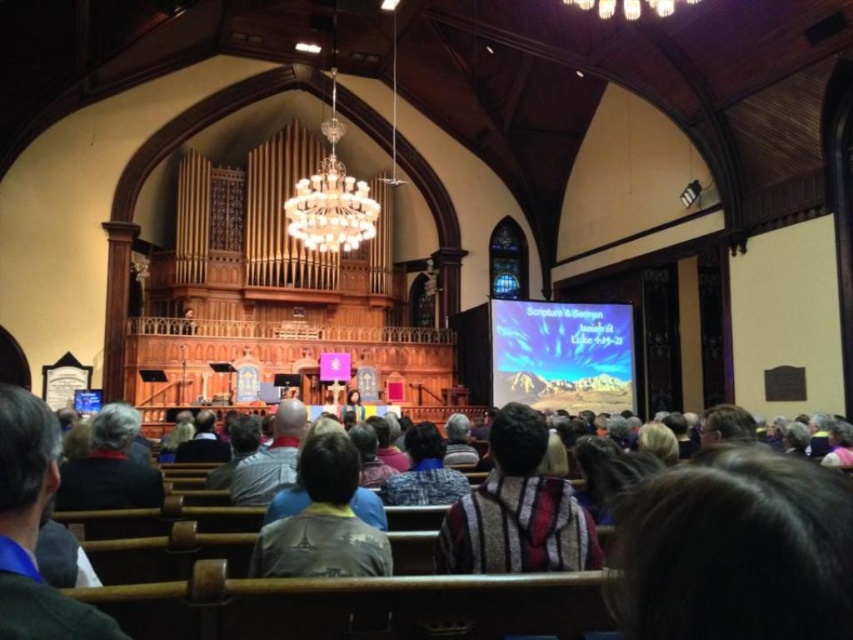
Question: Is multicolored woven fabric at center in front of dark gray sweater at lower left?

Choices:
 (A) yes
 (B) no

Answer: (A)

Question: Is multicolored woven fabric at center to the right of gray sweater at center from the viewer's perspective?

Choices:
 (A) no
 (B) yes

Answer: (B)

Question: Which object appears farthest from the camera in this image?

Choices:
 (A) gray fabric at lower left
 (B) striped sweater at center
 (C) dark gray sweater at center
 (D) dark gray sweater at lower left

Answer: (C)

Question: Which of the following is the farthest from the observer?

Choices:
 (A) (202, 444)
 (B) (436, 449)
 (C) (259, 499)

Answer: (A)

Question: Can you confirm if striped sweater at center is wider than gray sweater at center?

Choices:
 (A) yes
 (B) no

Answer: (B)

Question: Which of the following is the closest to the observer?

Choices:
 (A) striped sweater at center
 (B) dark gray sweater at lower left

Answer: (A)